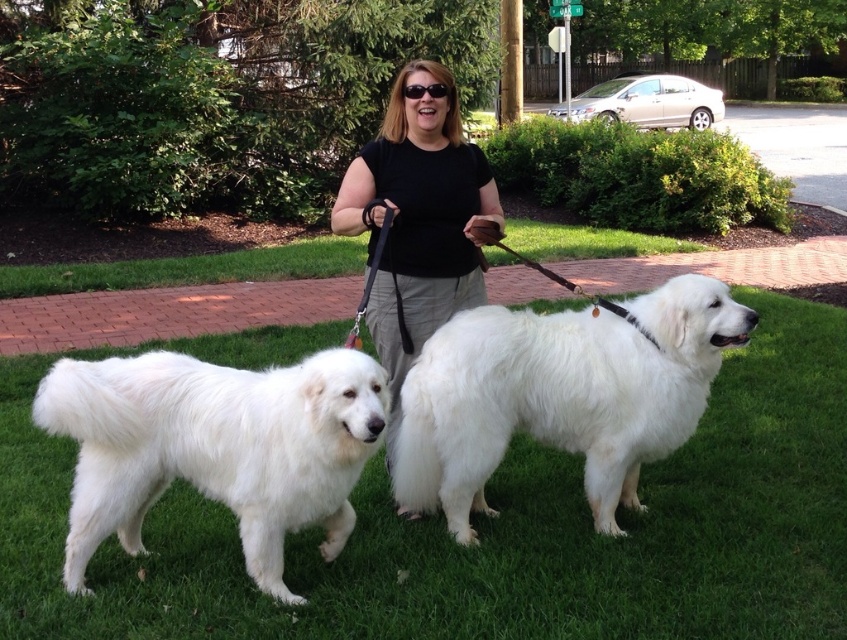
Question: Which point is farther to the camera?

Choices:
 (A) green grass at center
 (B) black fabric shirt at center
 (C) white fluffy dog at lower left

Answer: (B)

Question: Among these points, which one is nearest to the camera?

Choices:
 (A) (419, 83)
 (B) (710, 288)
 (C) (198, 499)

Answer: (B)

Question: Which of the following is the closest to the observer?

Choices:
 (A) (491, 179)
 (B) (286, 458)

Answer: (B)

Question: Is white fluffy dog at center closer to camera compared to black fabric shirt at center?

Choices:
 (A) yes
 (B) no

Answer: (A)

Question: Can you confirm if white fluffy dog at lower left is thinner than black fabric shirt at center?

Choices:
 (A) yes
 (B) no

Answer: (B)

Question: In this image, where is green grass at center located relative to white fluffy dog at center?

Choices:
 (A) right
 (B) left

Answer: (B)